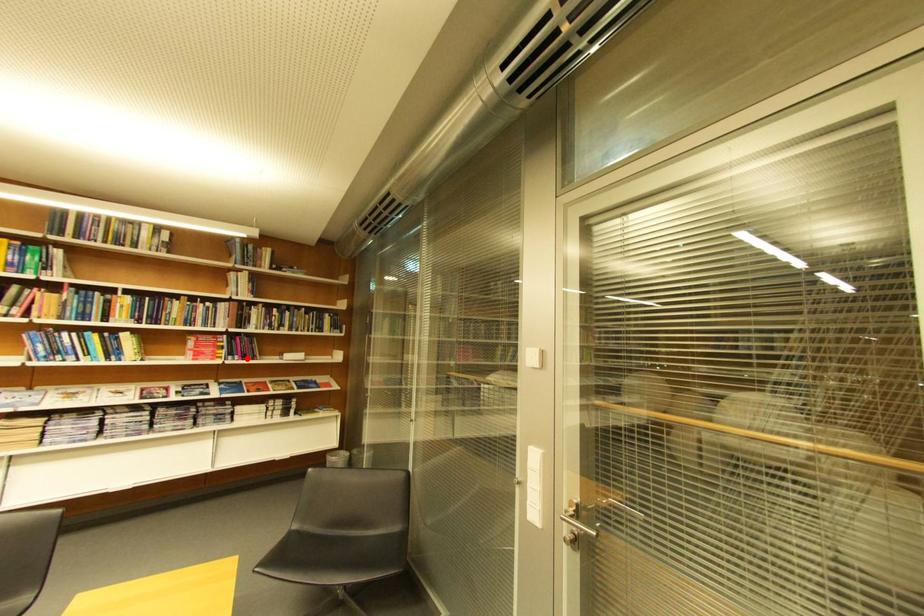
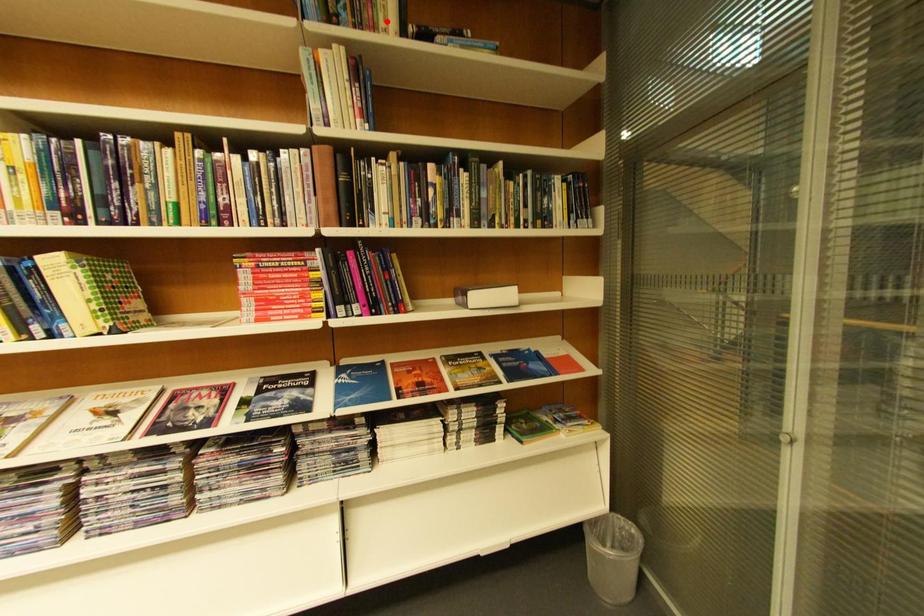
I am providing you with two images of the same scene from different viewpoints. A red point is marked on the first image and another point is marked on the second image. Do the highlighted points in image1 and image2 indicate the same real-world spot?

No